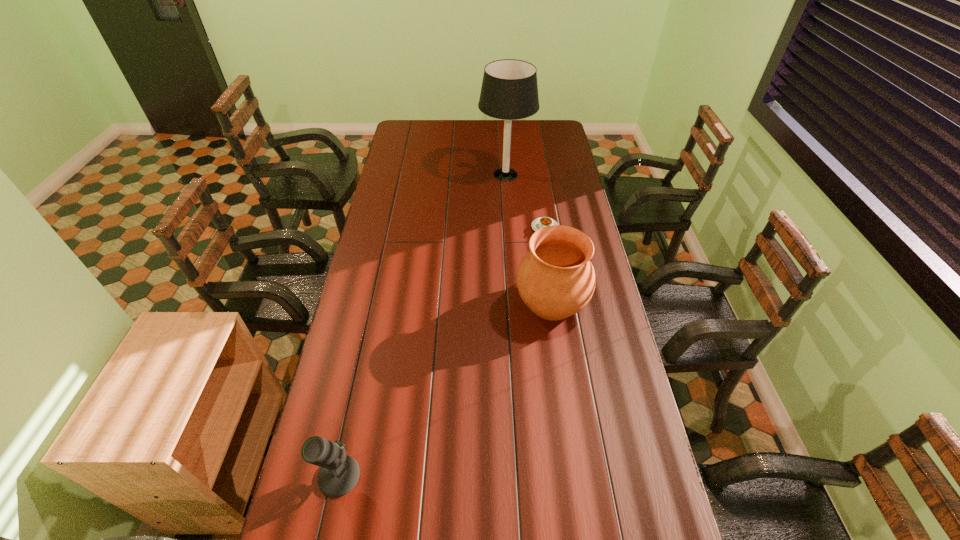
Image resolution: width=960 pixels, height=540 pixels. Find the location of `free space between the pudding and the nearest object`. free space between the pudding and the nearest object is located at coordinates (442, 352).

Where is `empty space between the table lamp and the shortest object`? The width and height of the screenshot is (960, 540). empty space between the table lamp and the shortest object is located at coordinates [525, 201].

Image resolution: width=960 pixels, height=540 pixels. What are the coordinates of `free spot between the pottery and the tallest object` in the screenshot? It's located at point(529,238).

Where is `unoccupied position between the third tallest object and the shortest object`? This screenshot has height=540, width=960. unoccupied position between the third tallest object and the shortest object is located at coordinates pos(442,352).

Find the location of a particular element. This screenshot has height=540, width=960. vacant space that is in between the pottery and the farthest object is located at coordinates (529, 238).

Locate an element on the screen. vacant region between the second nearest object and the leftmost object is located at coordinates pos(445,389).

In order to click on vacant space that's between the leftmost object and the second tallest object in this screenshot , I will do `click(445, 389)`.

The image size is (960, 540). What are the coordinates of `vacant point located between the pudding and the farthest object` in the screenshot? It's located at (525, 201).

The width and height of the screenshot is (960, 540). I want to click on free point between the second tallest object and the second shortest object, so click(445, 389).

The image size is (960, 540). Identify the location of object identified as the third closest to the tallest object. (339, 474).